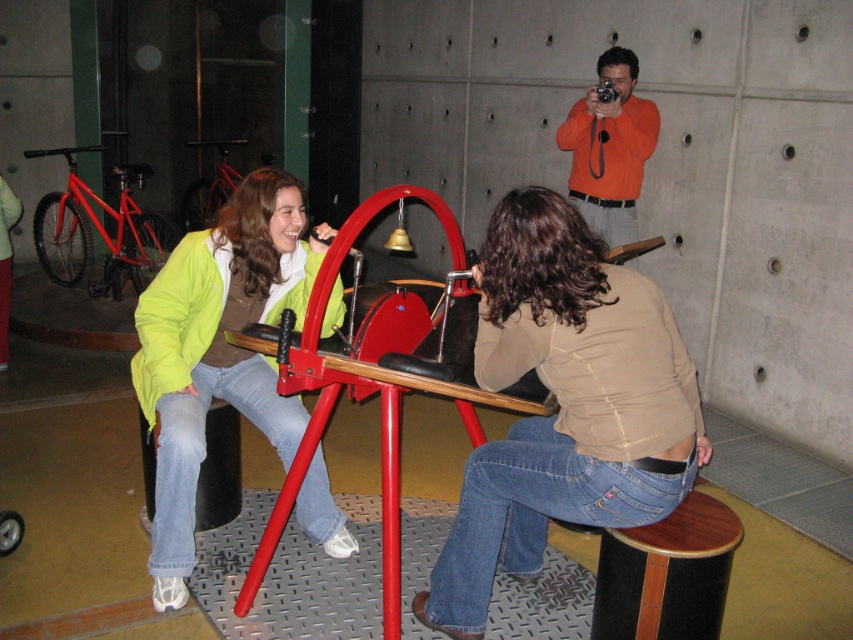
Question: Is matte green jacket at center to the right of orange cotton shirt at upper center from the viewer's perspective?

Choices:
 (A) yes
 (B) no

Answer: (B)

Question: Among these objects, which one is farthest from the camera?

Choices:
 (A) matte green jacket at center
 (B) matte brown shirt at center
 (C) orange cotton shirt at upper center

Answer: (C)

Question: Is matte brown shirt at center below orange cotton shirt at upper center?

Choices:
 (A) no
 (B) yes

Answer: (B)

Question: Considering the relative positions of matte green jacket at center and orange cotton shirt at upper center in the image provided, where is matte green jacket at center located with respect to orange cotton shirt at upper center?

Choices:
 (A) left
 (B) right

Answer: (A)

Question: Which object is positioned farthest from the orange cotton shirt at upper center?

Choices:
 (A) matte brown shirt at center
 (B) matte green jacket at center

Answer: (A)

Question: Which object is positioned farthest from the matte green jacket at center?

Choices:
 (A) matte brown shirt at center
 (B) orange cotton shirt at upper center

Answer: (B)